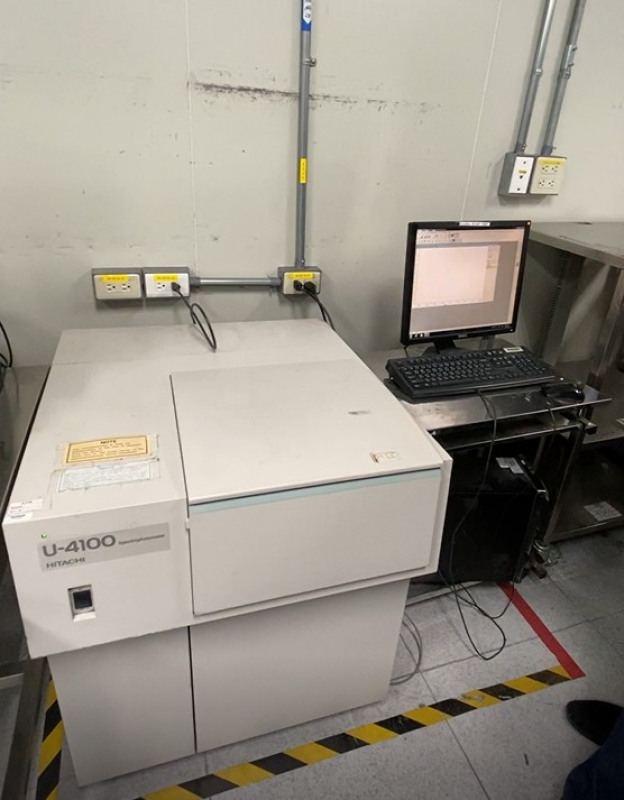
You are a GUI agent. You are given a task and a screenshot of the screen. Output one action in this format:
    pyautogui.click(x=<x>, y=<y>)
    Task: Click on the keyboard
    This screenshot has height=800, width=624.
    Given the screenshot: What is the action you would take?
    pyautogui.click(x=467, y=370)